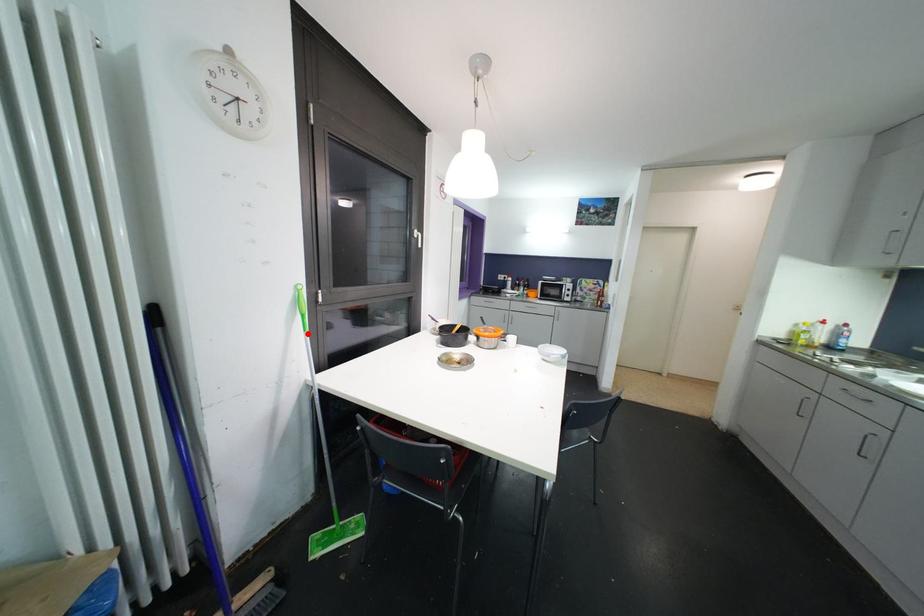
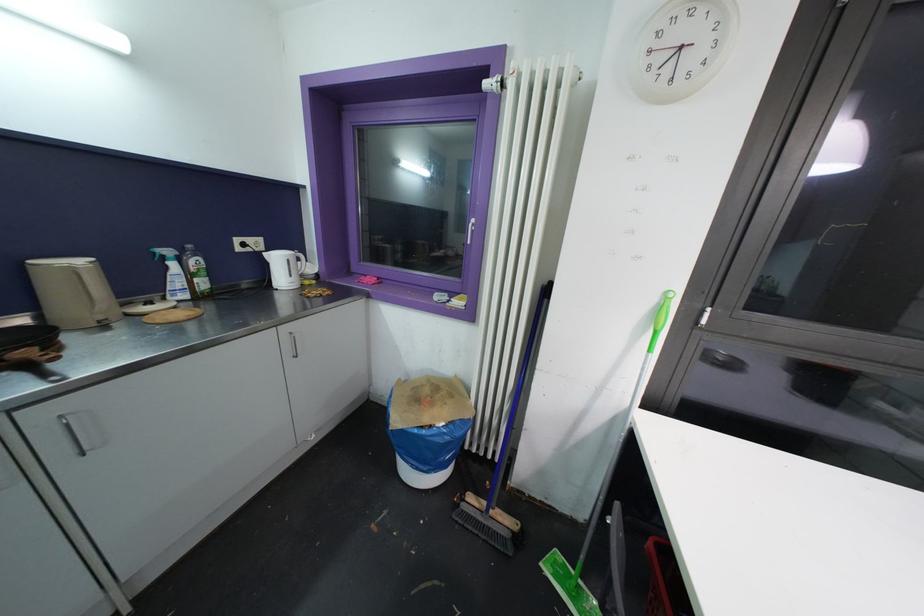
Locate, in the second image, the point that corresponds to the highlighted location in the first image.

(652, 354)